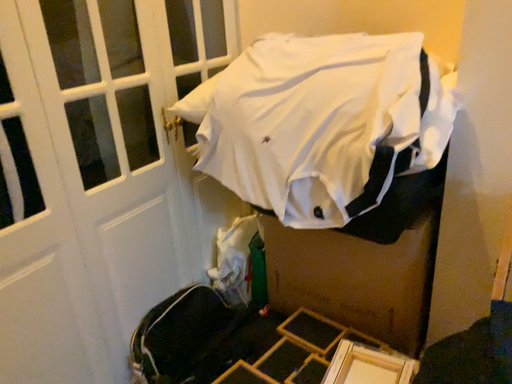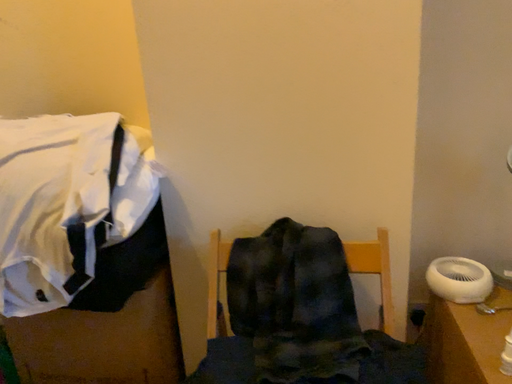
Question: How did the camera likely rotate when shooting the video?

Choices:
 (A) rotated left
 (B) rotated right

Answer: (B)